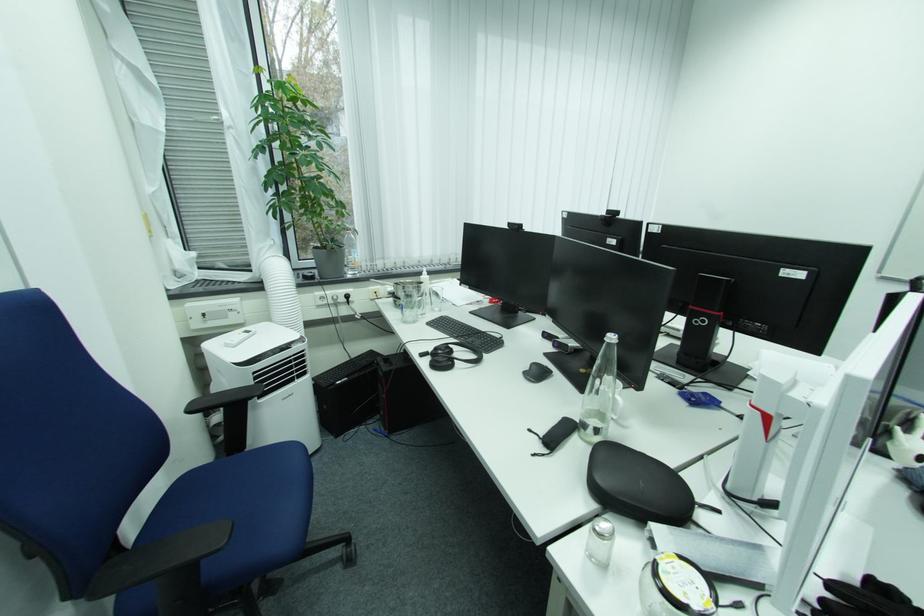
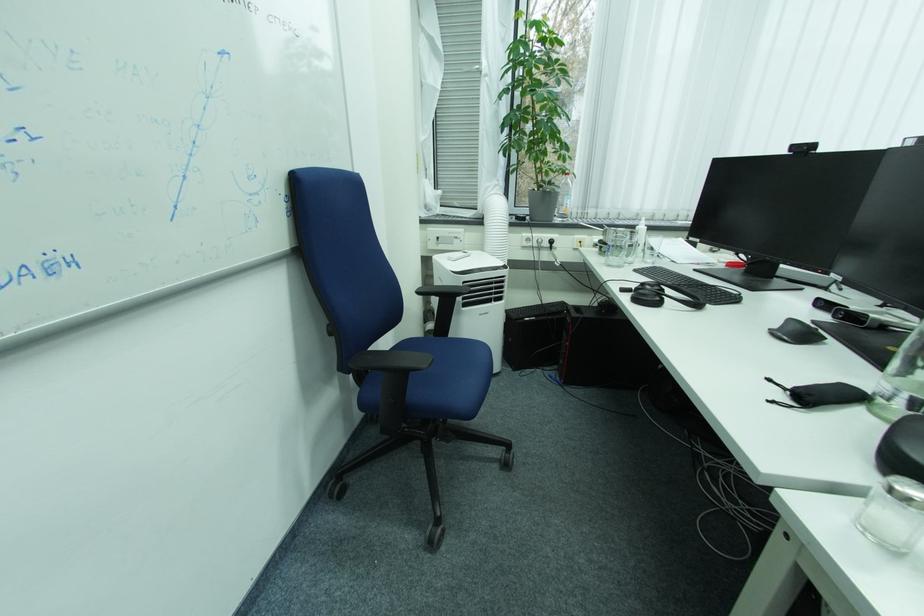
The point at (x=535, y=379) is marked in the first image. Where is the corresponding point in the second image?

(785, 334)